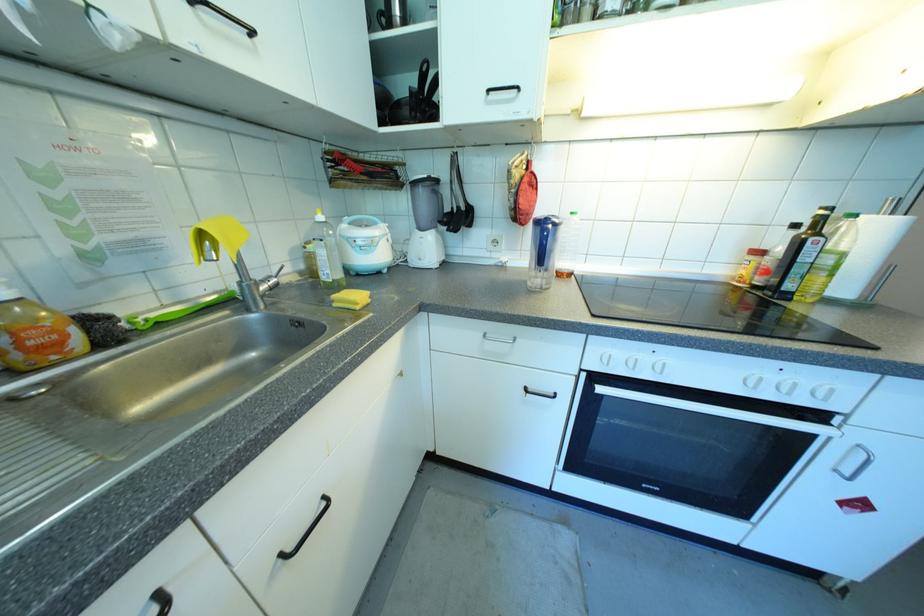
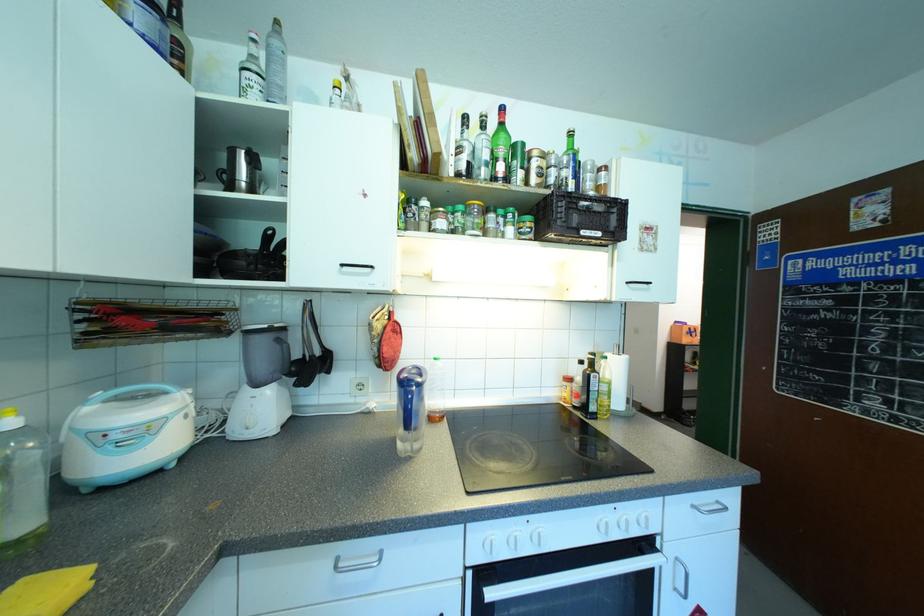
Where in the second image is the point corresponding to the point at 514,339 from the first image?

(380, 557)